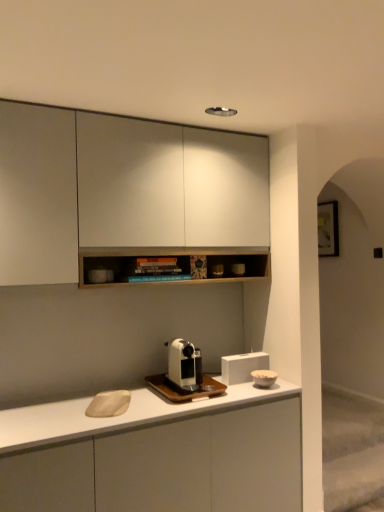
Question: Which direction should I rotate to face white matte speaker at center, the 1th appliance viewed from the back, — up or down?

Choices:
 (A) down
 (B) up

Answer: (A)

Question: Should I look upward or downward to see white matte cabinet at upper center, which appears as the first cabinetry when viewed from the top?

Choices:
 (A) up
 (B) down

Answer: (A)

Question: Considering the relative sizes of white matte cabinet at upper center, the second cabinetry in the bottom-to-top sequence, and white glossy coffee machine at center, placed as the first coffee machine when sorted from bottom to top, in the image provided, is white matte cabinet at upper center, the second cabinetry in the bottom-to-top sequence, wider than white glossy coffee machine at center, placed as the first coffee machine when sorted from bottom to top,?

Choices:
 (A) yes
 (B) no

Answer: (B)

Question: Does white matte cabinet at upper center, which appears as the first cabinetry when viewed from the top, appear on the right side of white glossy coffee machine at center, placed as the first coffee machine when sorted from bottom to top?

Choices:
 (A) yes
 (B) no

Answer: (B)

Question: Is white matte cabinet at upper center, the second cabinetry in the bottom-to-top sequence, further to the viewer compared to white glossy coffee machine at center, which is the 2th coffee machine in top-to-bottom order?

Choices:
 (A) no
 (B) yes

Answer: (A)

Question: Would you say white matte cabinet at upper center, the second cabinetry in the bottom-to-top sequence, contains white glossy coffee machine at center, placed as the first coffee machine when sorted from bottom to top?

Choices:
 (A) no
 (B) yes

Answer: (A)

Question: Is white matte cabinet at upper center, which appears as the first cabinetry when viewed from the top, not inside white glossy coffee machine at center, placed as the first coffee machine when sorted from bottom to top?

Choices:
 (A) no
 (B) yes

Answer: (B)

Question: From a real-world perspective, is white matte cabinet at upper center, the second cabinetry in the bottom-to-top sequence, positioned under white glossy coffee machine at center, placed as the first coffee machine when sorted from bottom to top, based on gravity?

Choices:
 (A) yes
 (B) no

Answer: (B)

Question: Does white glossy coffee machine at center, placed as the first coffee machine when sorted from bottom to top, come behind white matte speaker at center, the 1th appliance viewed from the back?

Choices:
 (A) yes
 (B) no

Answer: (B)

Question: Are white glossy coffee machine at center, which is the 2th coffee machine in top-to-bottom order, and white matte speaker at center, the 2th appliance from the front, beside each other?

Choices:
 (A) yes
 (B) no

Answer: (B)

Question: Is white glossy coffee machine at center, placed as the first coffee machine when sorted from bottom to top, at the left side of white matte speaker at center, the 2th appliance from the front?

Choices:
 (A) no
 (B) yes

Answer: (B)

Question: Is white glossy coffee machine at center, placed as the first coffee machine when sorted from bottom to top, facing towards white matte speaker at center, the 2th appliance from the front?

Choices:
 (A) no
 (B) yes

Answer: (A)

Question: Is white glossy coffee machine at center, placed as the first coffee machine when sorted from bottom to top, thinner than white matte speaker at center, the 1th appliance viewed from the back?

Choices:
 (A) yes
 (B) no

Answer: (B)

Question: From a real-world perspective, is white glossy coffee machine at center, placed as the first coffee machine when sorted from bottom to top, located beneath white matte speaker at center, the 1th appliance viewed from the back?

Choices:
 (A) no
 (B) yes

Answer: (B)

Question: From a real-world perspective, is white matte cabinet at upper center, which appears as the first cabinetry when viewed from the top, on white glossy coffee machine at center, which is counted as the 2th coffee machine, starting from the bottom?

Choices:
 (A) yes
 (B) no

Answer: (A)